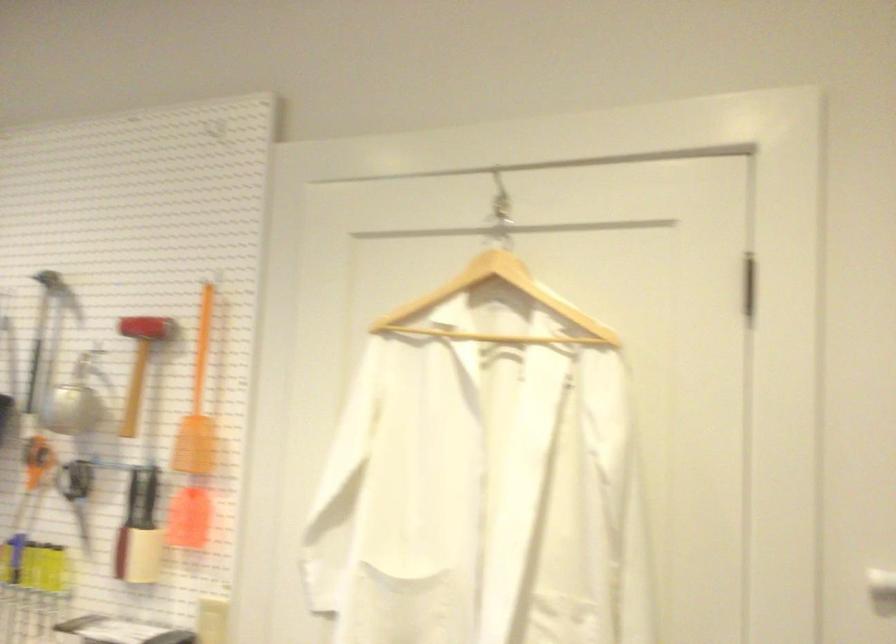
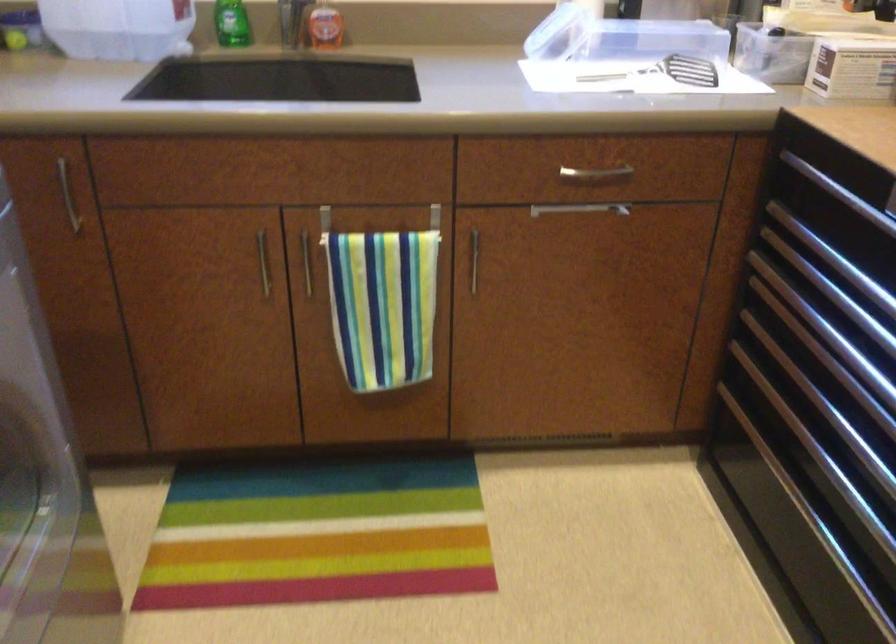
How did the camera likely rotate?

The camera's rotation is toward left-down.